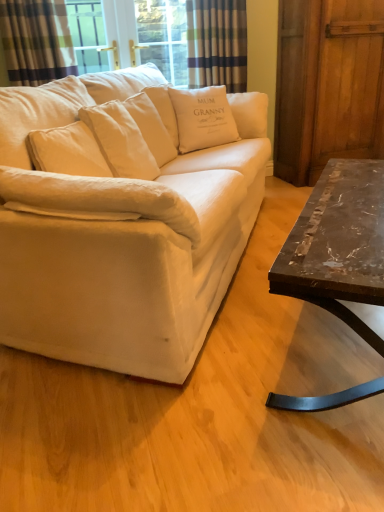
Locate an element on the screen. The width and height of the screenshot is (384, 512). free space above marble/black metal coffee table at right (from a real-world perspective) is located at coordinates (352, 208).